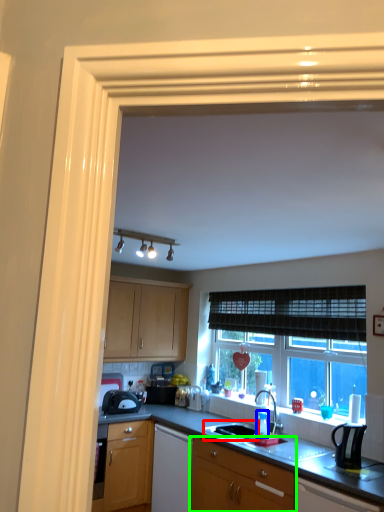
Question: Estimate the real-world distances between objects in this image. Which object is closer to sink (highlighted by a red box), bottle (highlighted by a blue box) or cabinetry (highlighted by a green box)?

Choices:
 (A) bottle
 (B) cabinetry

Answer: (A)